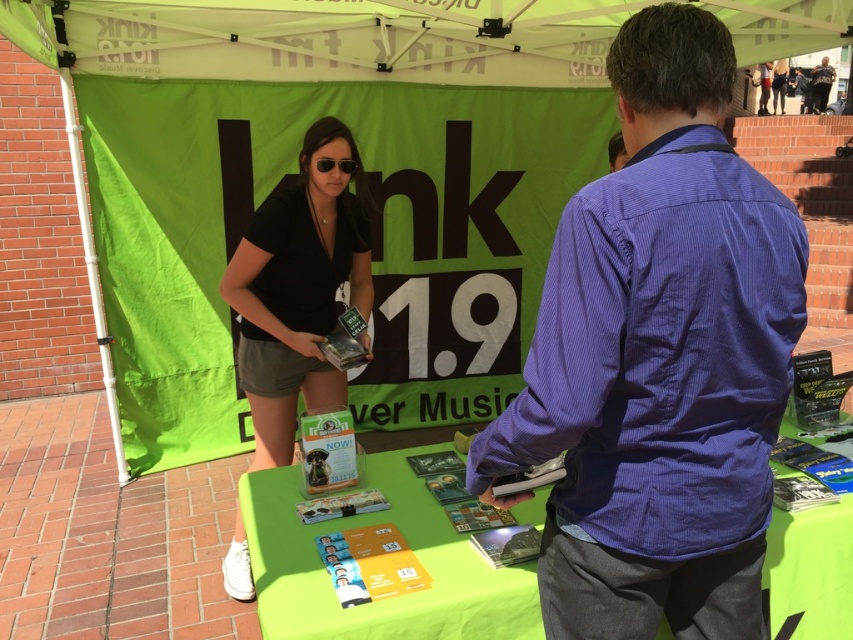
Who is lower down, purple shirt at center or green fabric canopy at upper center?

purple shirt at center is below.

Describe the element at coordinates (659, 358) in the screenshot. I see `purple shirt at center` at that location.

Find the location of a particular element. The image size is (853, 640). purple shirt at center is located at coordinates (659, 358).

Can you confirm if purple shirt at center is taller than green fabric table at center?

Yes, purple shirt at center is taller than green fabric table at center.

Can you confirm if purple shirt at center is positioned to the left of green fabric table at center?

Incorrect, purple shirt at center is not on the left side of green fabric table at center.

Who is more forward, (616, 512) or (480, 620)?

Point (616, 512)

Locate an element on the screen. This screenshot has height=640, width=853. purple shirt at center is located at coordinates (659, 358).

Is point (265, 449) positioned behind point (343, 164)?

Yes, point (265, 449) is behind point (343, 164).

Who is more distant from viewer, (x=270, y=390) or (x=315, y=168)?

The point (x=270, y=390) is more distant.

At what (x,y) coordinates should I click in order to perform the action: click on black matte shirt at center. Please return your answer as a coordinate pair (x, y). Looking at the image, I should click on (299, 291).